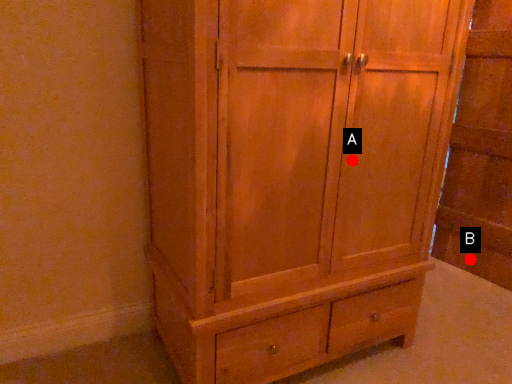
Question: Two points are circled on the image, labeled by A and B beside each circle. Among these points, which one is nearest to the camera?

Choices:
 (A) A is closer
 (B) B is closer

Answer: (A)